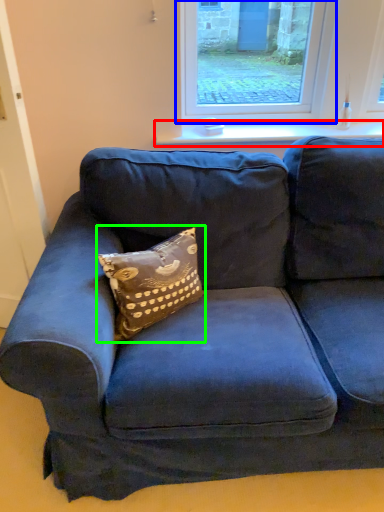
Question: Considering the real-world distances, which object is closest to window sill (highlighted by a red box)? window (highlighted by a blue box) or pillow (highlighted by a green box).

Choices:
 (A) window
 (B) pillow

Answer: (A)